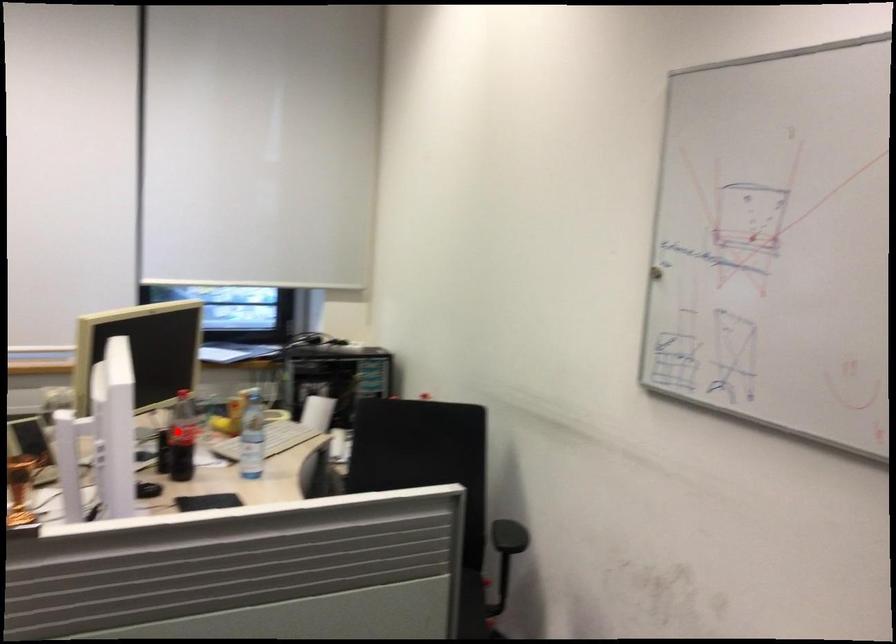
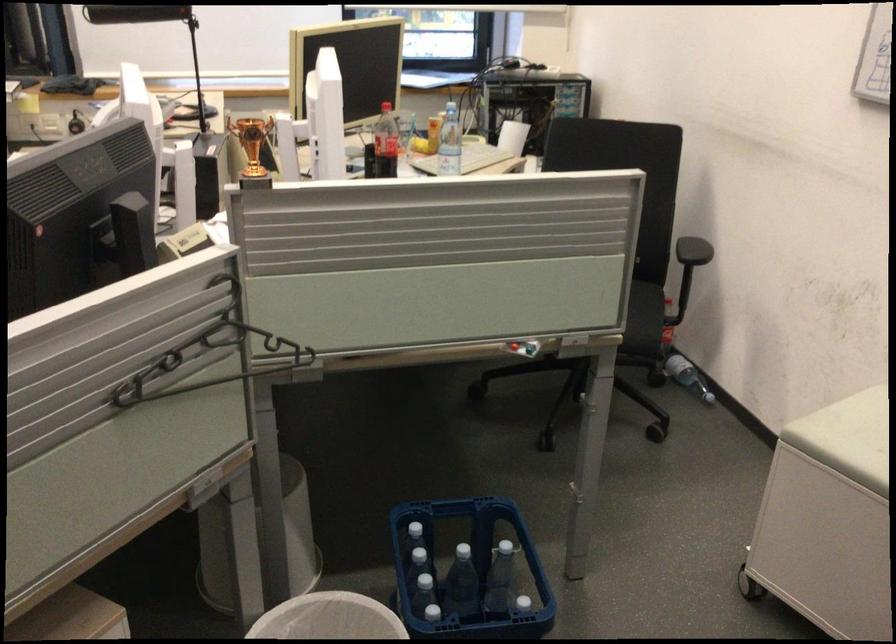
Question: I am providing you with two images of the same scene from different viewpoints. A red point is marked on the first image. Is the red point's position out of view in image 2?

Choices:
 (A) Yes
 (B) No

Answer: (B)